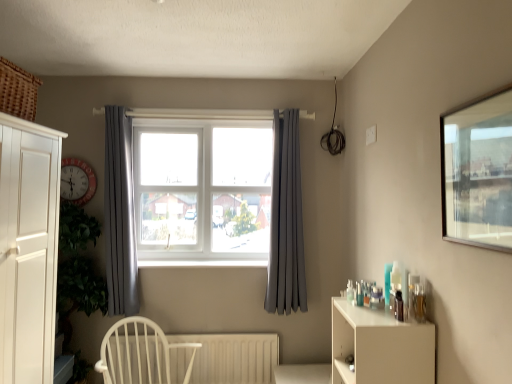
Question: Does white wood chair at lower left have a lesser height compared to satin grey curtain at center, which appears as the 1th curtain when viewed from the right?

Choices:
 (A) yes
 (B) no

Answer: (A)

Question: From the image's perspective, would you say white wood chair at lower left is positioned over satin grey curtain at center, which appears as the 1th curtain when viewed from the right?

Choices:
 (A) yes
 (B) no

Answer: (B)

Question: Is satin grey curtain at center, which appears as the 1th curtain when viewed from the right, a part of white wood chair at lower left?

Choices:
 (A) no
 (B) yes

Answer: (A)

Question: Is white wood chair at lower left outside of satin grey curtain at center, the 2th curtain positioned from the left?

Choices:
 (A) no
 (B) yes

Answer: (B)

Question: Is white wood chair at lower left closer to the viewer compared to satin grey curtain at center, the 2th curtain positioned from the left?

Choices:
 (A) no
 (B) yes

Answer: (B)

Question: Considering the relative positions of gray fabric curtain at left, positioned as the first curtain in left-to-right order, and white wood chair at lower left in the image provided, is gray fabric curtain at left, positioned as the first curtain in left-to-right order, to the left or to the right of white wood chair at lower left?

Choices:
 (A) left
 (B) right

Answer: (A)

Question: In terms of height, does gray fabric curtain at left, placed as the second curtain when sorted from right to left, look taller or shorter compared to white wood chair at lower left?

Choices:
 (A) tall
 (B) short

Answer: (A)

Question: Is point (117, 152) positioned closer to the camera than point (117, 354)?

Choices:
 (A) closer
 (B) farther

Answer: (B)

Question: Looking at their shapes, would you say gray fabric curtain at left, placed as the second curtain when sorted from right to left, is wider or thinner than white wood chair at lower left?

Choices:
 (A) wide
 (B) thin

Answer: (B)

Question: From a real-world perspective, is white matte shelf at right above or below satin grey curtain at center, the 2th curtain positioned from the left?

Choices:
 (A) above
 (B) below

Answer: (B)

Question: Considering the positions of white matte shelf at right and satin grey curtain at center, the 2th curtain positioned from the left, in the image, is white matte shelf at right bigger or smaller than satin grey curtain at center, the 2th curtain positioned from the left,?

Choices:
 (A) big
 (B) small

Answer: (B)

Question: From the image's perspective, is white matte shelf at right above or below satin grey curtain at center, the 2th curtain positioned from the left?

Choices:
 (A) below
 (B) above

Answer: (A)

Question: Is point (334, 374) positioned closer to the camera than point (289, 291)?

Choices:
 (A) closer
 (B) farther

Answer: (A)

Question: In terms of height, does matte red clock at left look taller or shorter compared to white wood chair at lower left?

Choices:
 (A) tall
 (B) short

Answer: (B)

Question: Is matte red clock at left bigger or smaller than white wood chair at lower left?

Choices:
 (A) small
 (B) big

Answer: (A)